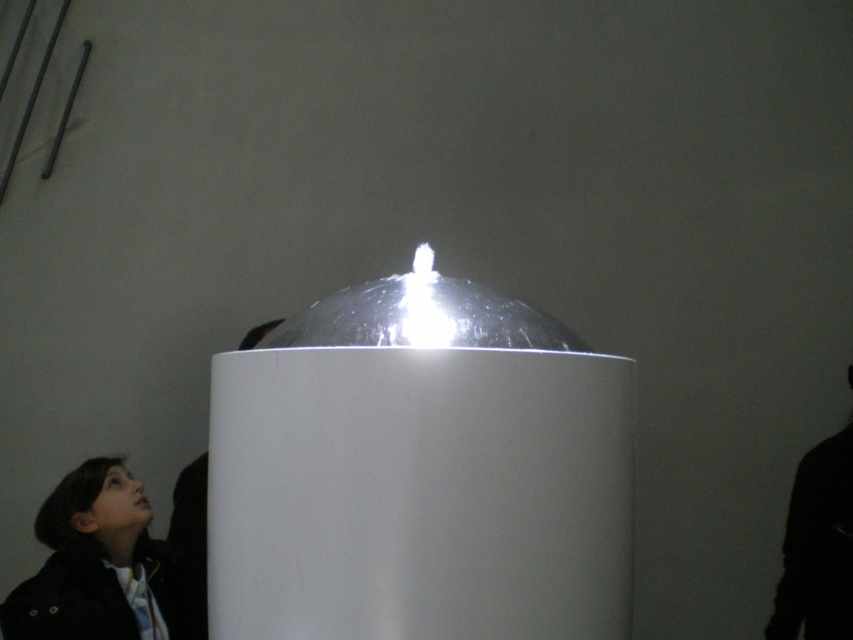
Is point (51, 506) farther from camera compared to point (251, 337)?

No, (51, 506) is in front of (251, 337).

Is point (39, 515) positioned after point (167, 614)?

No, it is in front of (167, 614).

At what (x,y) coordinates should I click in order to perform the action: click on black fabric jacket at lower left. Please return your answer as a coordinate pair (x, y). Looking at the image, I should click on (91, 563).

Does transparent plastic dome at center come behind black fabric jacket at lower left?

No, transparent plastic dome at center is in front of black fabric jacket at lower left.

In the scene shown: Is transparent plastic dome at center to the right of black fabric jacket at lower left from the viewer's perspective?

Indeed, transparent plastic dome at center is positioned on the right side of black fabric jacket at lower left.

Is point (480, 403) behind point (90, 492)?

No, it is not.

The image size is (853, 640). I want to click on transparent plastic dome at center, so click(x=419, y=472).

In the scene shown: Can you confirm if black fabric jacket at lower left is wider than black matte jacket at right?

Indeed, black fabric jacket at lower left has a greater width compared to black matte jacket at right.

Does point (120, 586) lie behind point (842, 520)?

No, it is in front of (842, 520).

This screenshot has height=640, width=853. What do you see at coordinates (91, 563) in the screenshot?
I see `black fabric jacket at lower left` at bounding box center [91, 563].

I want to click on black fabric jacket at lower left, so (x=91, y=563).